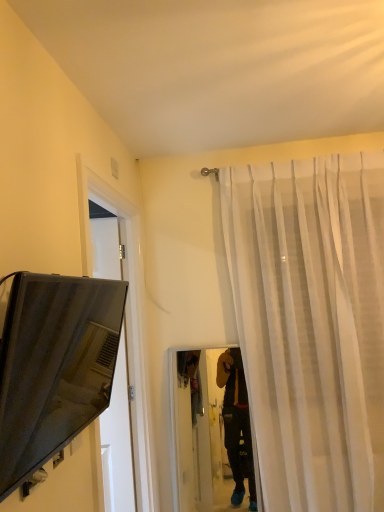
Question: Is white sheer curtain at upper right inside the boundaries of matte black tv at left, or outside?

Choices:
 (A) inside
 (B) outside

Answer: (B)

Question: From the image's perspective, is white sheer curtain at upper right located above or below matte black tv at left?

Choices:
 (A) above
 (B) below

Answer: (B)

Question: Considering the relative positions of white sheer curtain at upper right and matte black tv at left in the image provided, is white sheer curtain at upper right to the left or to the right of matte black tv at left?

Choices:
 (A) left
 (B) right

Answer: (B)

Question: Considering the positions of matte black tv at left and white sheer curtain at upper right in the image, is matte black tv at left bigger or smaller than white sheer curtain at upper right?

Choices:
 (A) big
 (B) small

Answer: (B)

Question: Is point (21, 336) closer or farther from the camera than point (299, 189)?

Choices:
 (A) closer
 (B) farther

Answer: (A)

Question: Considering the positions of matte black tv at left and white sheer curtain at upper right in the image, is matte black tv at left wider or thinner than white sheer curtain at upper right?

Choices:
 (A) thin
 (B) wide

Answer: (A)

Question: Considering their positions, is matte black tv at left located in front of or behind white sheer curtain at upper right?

Choices:
 (A) front
 (B) behind

Answer: (A)